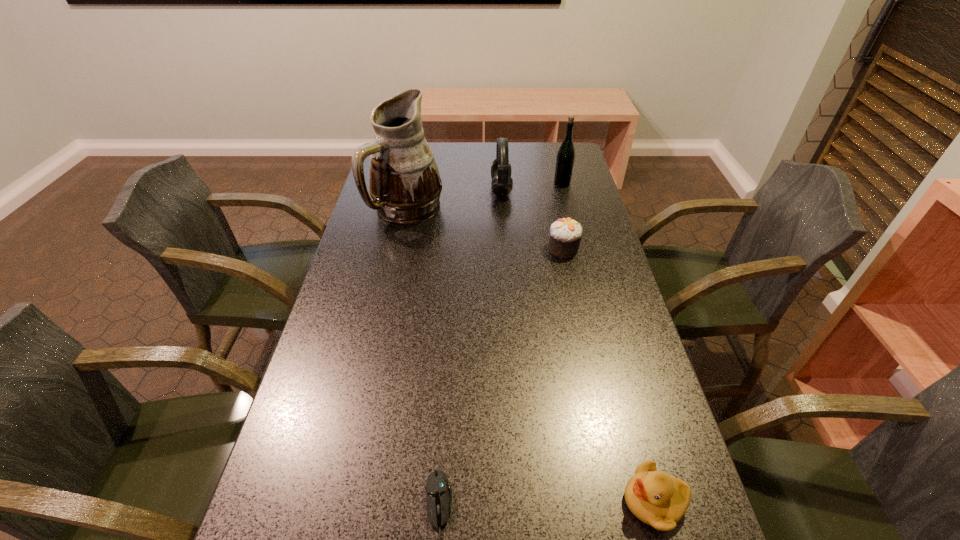
Where is `the leftmost object`? This screenshot has height=540, width=960. the leftmost object is located at coordinates (405, 185).

You are a GUI agent. You are given a task and a screenshot of the screen. Output one action in this format:
    pyautogui.click(x=<x>, y=<y>)
    Task: Click on the pitcher
    
    Given the screenshot: What is the action you would take?
    pyautogui.click(x=405, y=185)

The image size is (960, 540). Identify the location of the second tallest object. (566, 154).

In order to click on headset in this screenshot , I will do `click(502, 184)`.

Where is `the third tallest object`? The width and height of the screenshot is (960, 540). the third tallest object is located at coordinates (502, 184).

Identify the location of the third nearest object. (565, 234).

You are a GUI agent. You are given a task and a screenshot of the screen. Output one action in this format:
    pyautogui.click(x=<x>, y=<y>)
    Task: Click on the duckling
    The width and height of the screenshot is (960, 540).
    Given the screenshot: What is the action you would take?
    pyautogui.click(x=658, y=499)

Where is `vacant space located from the spout of the tallest object`? vacant space located from the spout of the tallest object is located at coordinates (388, 303).

Locate an element on the screen. The height and width of the screenshot is (540, 960). vacant space located on the left of the beer bottle is located at coordinates (486, 184).

The image size is (960, 540). I want to click on free region located 0.230m on the earcups of the headset, so click(424, 190).